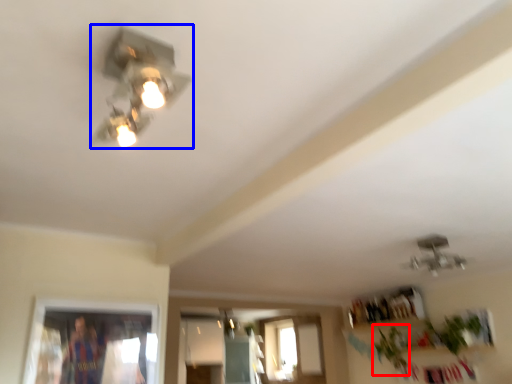
Question: Which point is further to the camera, plant (highlighted by a red box) or lamp (highlighted by a blue box)?

Choices:
 (A) plant
 (B) lamp

Answer: (A)